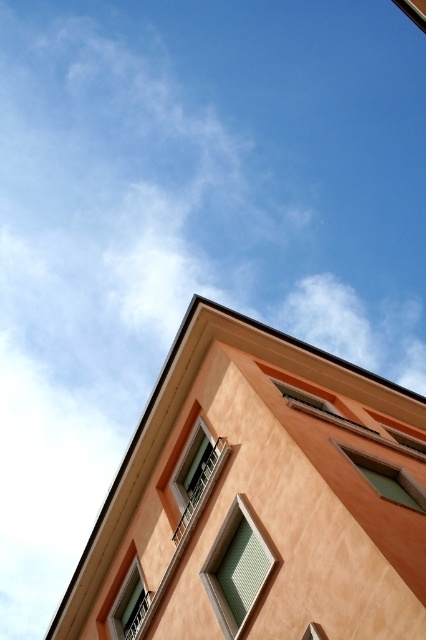
You are standing at the base of the building looking up. Which window is positioned to the right when comparing the green glass window at lower right and the matte glass window at lower left?

The green glass window at lower right is positioned to the right of the matte glass window at lower left.

You are a window cleaner standing at the base of the building. You need to clean the green glass window at lower right. Given that your ladder can reach up to 14 meters, will you be able to reach the window?

The green glass window at lower right is 14.26 meters from the camera, which is slightly beyond the ladder maximum reach of 14 meters. Therefore, the ladder will not be sufficient to reach the window.

You are standing in front of the building and want to take a photo. You notice two points marked on the building facade. The first point is at coordinate point (400, 499) and the second is at point (124, 620). Which point appears closer to you when looking at the building?

Point (400, 499) is closer to the camera than point (124, 620), so it appears closer to you when looking at the building.